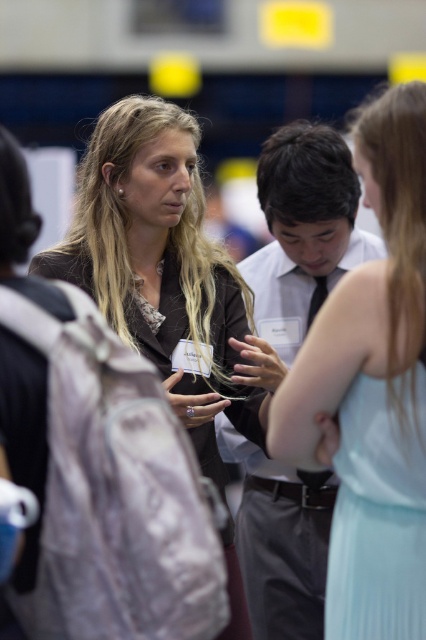
Question: Which point appears closest to the camera in this image?

Choices:
 (A) (172, 208)
 (B) (371, 234)

Answer: (A)

Question: Is matte black jacket at center positioned behind white shirt at center?

Choices:
 (A) no
 (B) yes

Answer: (A)

Question: Does matte black jacket at center appear under white shirt at center?

Choices:
 (A) yes
 (B) no

Answer: (A)

Question: Among these objects, which one is farthest from the camera?

Choices:
 (A) white shirt at center
 (B) matte black jacket at center

Answer: (A)

Question: Can you confirm if matte black jacket at center is positioned to the left of white shirt at center?

Choices:
 (A) yes
 (B) no

Answer: (A)